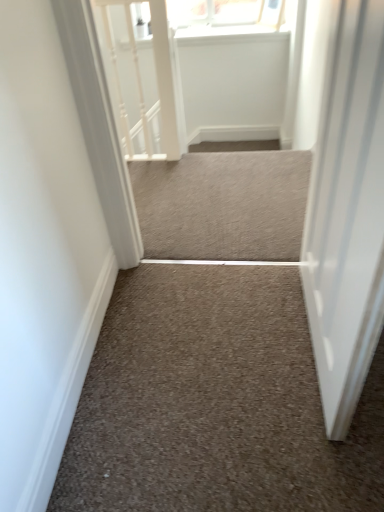
Question: In terms of size, does white glossy door at right appear bigger or smaller than neutral carpet at center, which appears as the 2th stairwell when viewed from the back?

Choices:
 (A) big
 (B) small

Answer: (A)

Question: From their relative heights in the image, would you say white glossy door at right is taller or shorter than neutral carpet at center, which appears as the 2th stairwell when viewed from the back?

Choices:
 (A) tall
 (B) short

Answer: (A)

Question: Which is farther from the white glossy door at right?

Choices:
 (A) neutral carpet at center, which is the 1th stairwell from back to front
 (B) white textured rail at upper left
 (C) neutral carpet at center, the 1th stairwell in the bottom-to-top sequence

Answer: (B)

Question: Estimate the real-world distances between objects in this image. Which object is farther from the neutral carpet at center, arranged as the second stairwell when viewed from the front?

Choices:
 (A) white glossy door at right
 (B) neutral carpet at center, the second stairwell positioned from the top
 (C) white textured rail at upper left

Answer: (B)